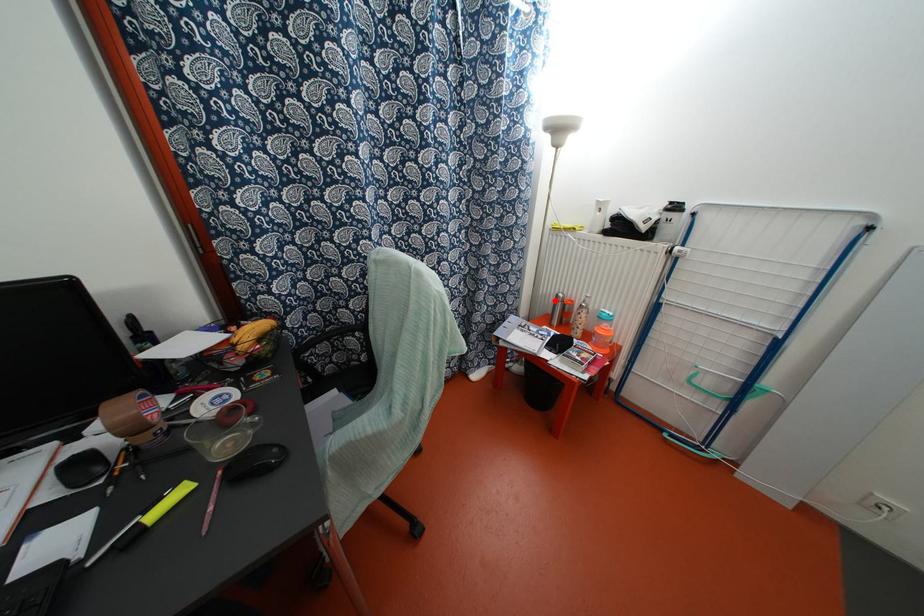
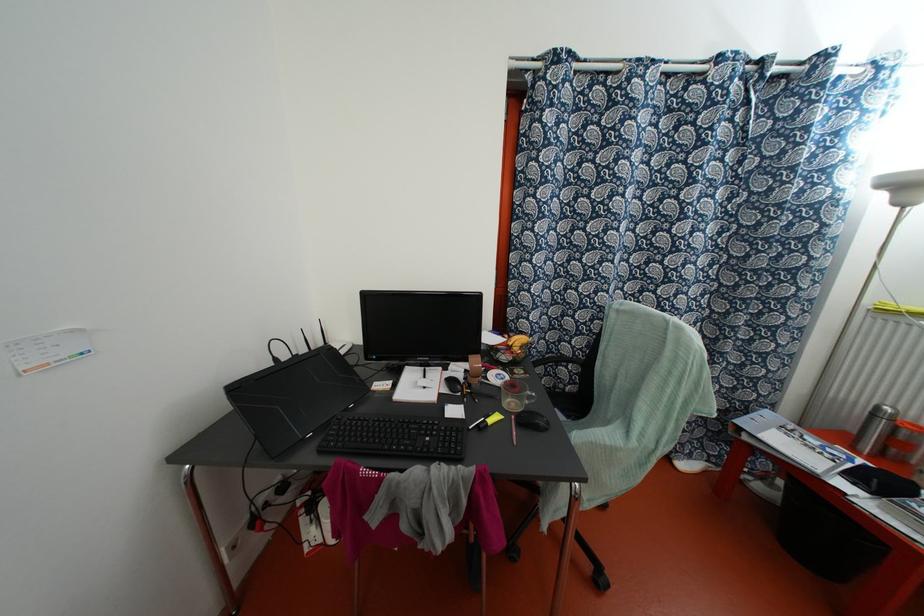
Locate, in the second image, the point that corresponds to the highlighted location in the first image.

(872, 415)